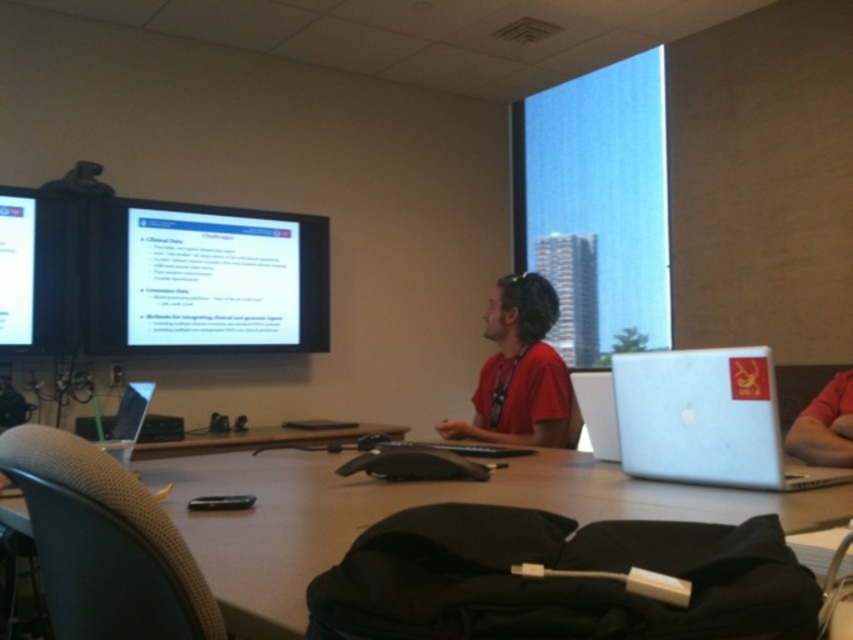
Question: Can you confirm if red matte shirt at right is positioned below silver metallic laptop at lower left?

Choices:
 (A) yes
 (B) no

Answer: (B)

Question: Does silver metallic laptop at right have a lesser width compared to red matte shirt at right?

Choices:
 (A) no
 (B) yes

Answer: (A)

Question: Which object appears closest to the camera in this image?

Choices:
 (A) smooth wooden table at center
 (B) red matte shirt at right
 (C) transparent glass window at upper center

Answer: (A)

Question: Which of the following is the farthest from the observer?

Choices:
 (A) (305, 496)
 (B) (109, 451)

Answer: (B)

Question: Observing the image, what is the correct spatial positioning of matte black monitor at left in reference to red matte shirt at right?

Choices:
 (A) right
 (B) left

Answer: (B)

Question: Which of the following is the closest to the observer?

Choices:
 (A) smooth wooden table at center
 (B) silver metallic laptop at right
 (C) transparent glass window at upper center
 (D) matte black monitor at left

Answer: (A)